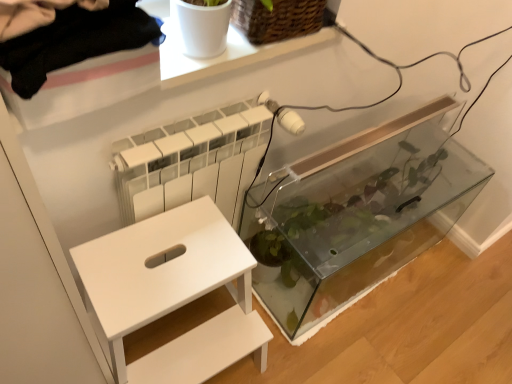
You are a GUI agent. You are given a task and a screenshot of the screen. Output one action in this format:
    pyautogui.click(x=<x>, y=<y>)
    Task: Click on the vacant space situated above white matte step stool at lower left (from a real-world perspective)
    The image size is (512, 384).
    Given the screenshot: What is the action you would take?
    pyautogui.click(x=167, y=261)